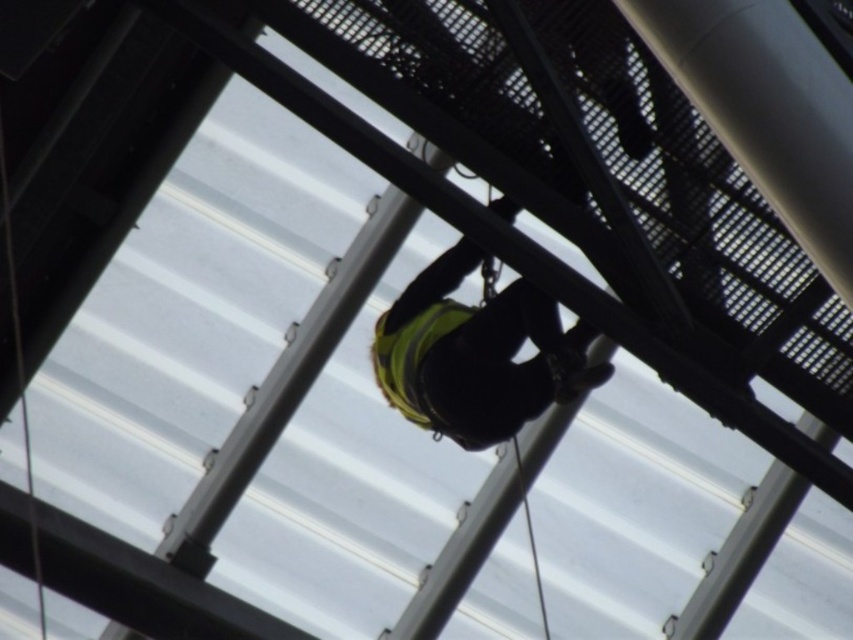
You are a safety inspector reviewing a construction site photo. You notice two points marked on the roof structure. The first point is at coordinates point [448,253] and the second at point [431,344]. Which point is closer to the inspector when looking at the image?

Point [448,253] is further to the viewer than point [431,344], so the second point is closer to the inspector.